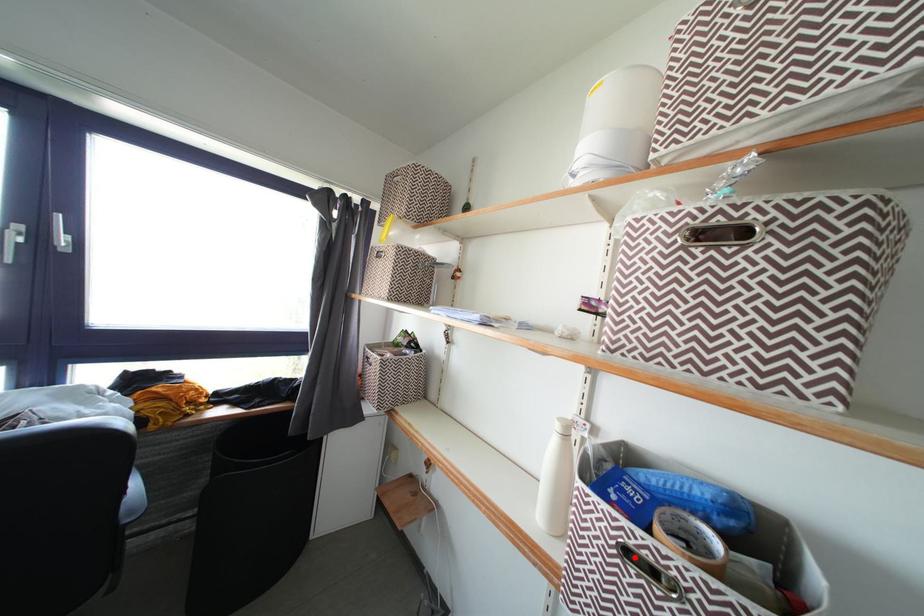
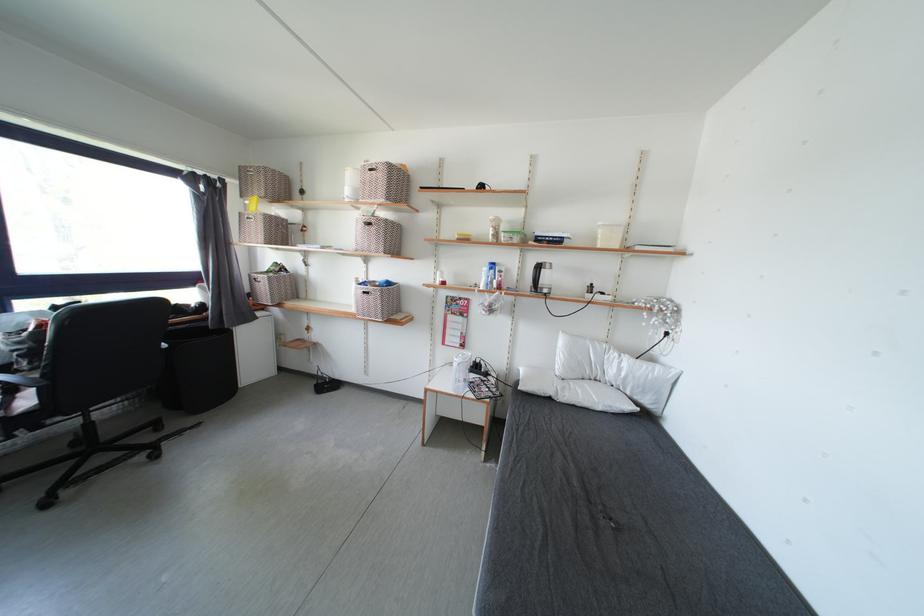
Find the pixel in the second image that matches the highlighted location in the first image.

(371, 297)